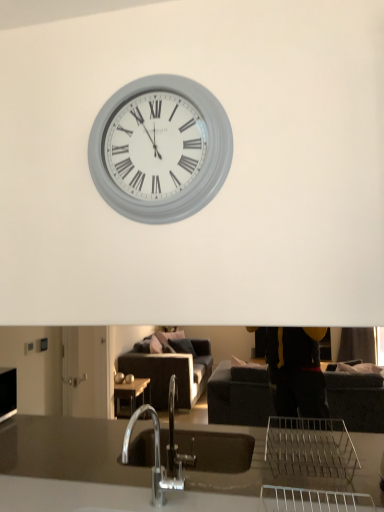
The width and height of the screenshot is (384, 512). Identify the location of light gray plastic clock at upper center. (160, 149).

The width and height of the screenshot is (384, 512). What do you see at coordinates (160, 149) in the screenshot?
I see `light gray plastic clock at upper center` at bounding box center [160, 149].

You are a GUI agent. You are given a task and a screenshot of the screen. Output one action in this format:
    pyautogui.click(x=<x>, y=<y>)
    Task: Click on the light gray plastic clock at upper center
    
    Given the screenshot: What is the action you would take?
    pyautogui.click(x=160, y=149)